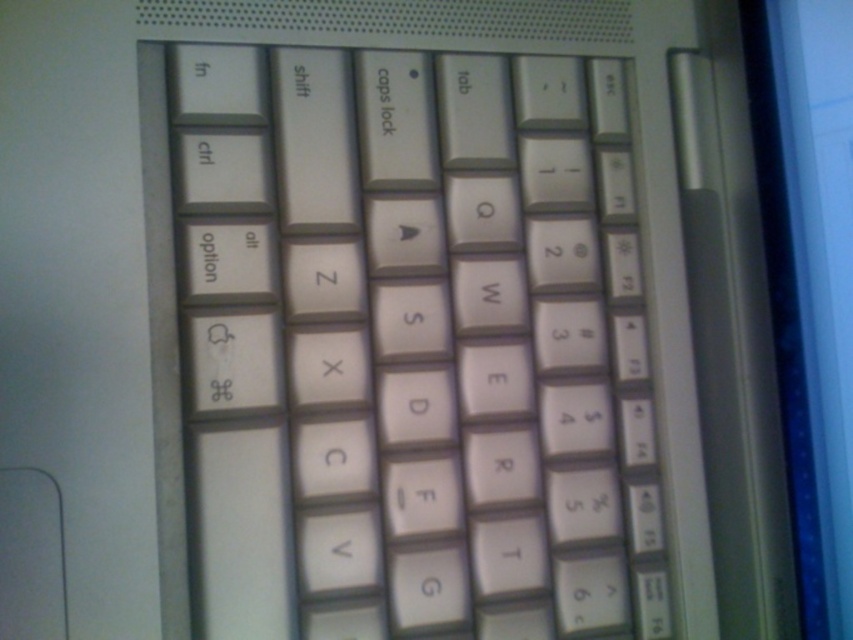
You are setting up a laptop on a small desk. The desk has just enough space for either the white plastic keyboard at center or the matte plastic screen at right, but not both. Which part of the laptop should you prioritize placing on the desk to ensure it fits?

The white plastic keyboard at center might be wider than matte plastic screen at right, so you should prioritize placing the white plastic keyboard at center on the desk to ensure it fits.

You are setting up a laptop for a presentation. You need to connect a USB cable to the laptop. The cable is too long and needs to be routed behind the laptop. Looking at the image, can you route the cable behind the white plastic keyboard at center and under the matte plastic screen at right?

The white plastic keyboard at center is positioned under the matte plastic screen at right, so you can route the cable behind the white plastic keyboard at center and under the matte plastic screen at right.

You are setting up a workspace and need to place a mouse next to the white plastic keyboard at center and the matte plastic screen at right. Given their sizes, where should you place the mouse to ensure it doesn

The white plastic keyboard at center is larger than the matte plastic screen at right, so placing the mouse to the right of the keyboard would provide enough space for comfortable use.